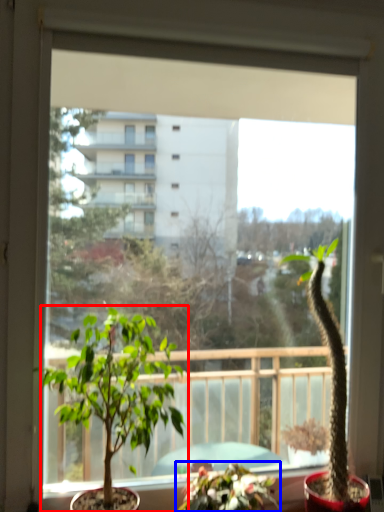
Question: Which of the following is the closest to the observer, houseplant (highlighted by a red box) or houseplant (highlighted by a blue box)?

Choices:
 (A) houseplant
 (B) houseplant

Answer: (A)